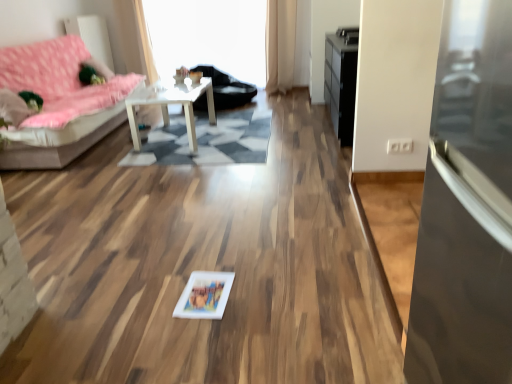
Locate an element on the screen. This screenshot has height=384, width=512. vacant location below beige fabric curtain at upper center (from a real-world perspective) is located at coordinates (284, 91).